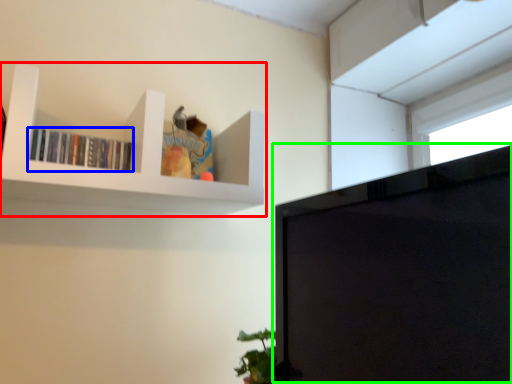
Question: Estimate the real-world distances between objects in this image. Which object is farther from shelf (highlighted by a red box), book (highlighted by a blue box) or computer monitor (highlighted by a green box)?

Choices:
 (A) book
 (B) computer monitor

Answer: (B)